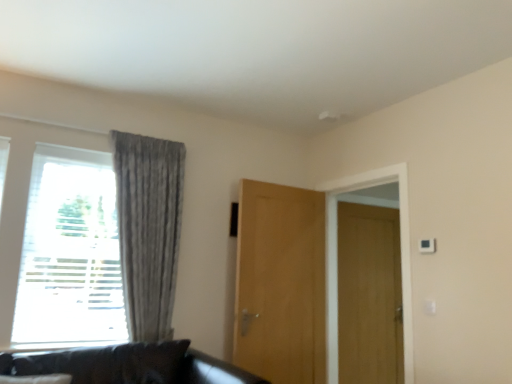
Image resolution: width=512 pixels, height=384 pixels. What do you see at coordinates (369, 295) in the screenshot? I see `wooden door at right, which ranks as the 2th door in left-to-right order` at bounding box center [369, 295].

The height and width of the screenshot is (384, 512). What do you see at coordinates (280, 283) in the screenshot? I see `light brown wood door at center, arranged as the 1th door when viewed from the front` at bounding box center [280, 283].

This screenshot has height=384, width=512. What do you see at coordinates (148, 229) in the screenshot?
I see `gray textured curtain at left` at bounding box center [148, 229].

What do you see at coordinates (26, 195) in the screenshot?
I see `white textured window at left` at bounding box center [26, 195].

This screenshot has width=512, height=384. Identify the location of wooden door at right, placed as the 1th door when sorted from back to front. (369, 295).

From the image's perspective, between light brown wood door at center, the second door when ordered from back to front, and white textured window at left, which one is located above?

white textured window at left, from the image's perspective.

Is light brown wood door at center, arranged as the 1th door when viewed from the front, in contact with white textured window at left?

No, light brown wood door at center, arranged as the 1th door when viewed from the front, is not making contact with white textured window at left.

I want to click on window located above the light brown wood door at center, the second door when ordered from back to front (from the image's perspective), so click(26, 195).

Is light brown wood door at center, the second door when ordered from back to front, facing away from white textured window at left?

That's not correct — light brown wood door at center, the second door when ordered from back to front, is not looking away from white textured window at left.

Could you tell me if wooden door at right, the second door viewed from the front, is turned towards gray textured curtain at left?

No, wooden door at right, the second door viewed from the front, is not turned towards gray textured curtain at left.

Is wooden door at right, the second door viewed from the front, situated inside gray textured curtain at left or outside?

wooden door at right, the second door viewed from the front, lies outside gray textured curtain at left.

Consider the image. Considering the relative sizes of wooden door at right, positioned as the first door in right-to-left order, and gray textured curtain at left in the image provided, is wooden door at right, positioned as the first door in right-to-left order, thinner than gray textured curtain at left?

Indeed, wooden door at right, positioned as the first door in right-to-left order, has a lesser width compared to gray textured curtain at left.

You are a GUI agent. You are given a task and a screenshot of the screen. Output one action in this format:
    pyautogui.click(x=<x>, y=<y>)
    Task: Click on the window below the gray textured curtain at left (from a real-world perspective)
    The image size is (512, 384).
    Given the screenshot: What is the action you would take?
    [x=26, y=195]

Can you confirm if gray textured curtain at left is positioned to the right of white textured window at left?

Correct, you'll find gray textured curtain at left to the right of white textured window at left.

Considering the sizes of objects gray textured curtain at left and white textured window at left in the image provided, who is wider, gray textured curtain at left or white textured window at left?

gray textured curtain at left.

Is gray textured curtain at left looking in the opposite direction of white textured window at left?

Yes, gray textured curtain at left's orientation is away from white textured window at left.

Measure the distance from gray textured curtain at left to light brown wood door at center, the second door in the right-to-left sequence.

gray textured curtain at left and light brown wood door at center, the second door in the right-to-left sequence, are 30.14 inches apart.

Which is behind, gray textured curtain at left or light brown wood door at center, arranged as the 1th door when viewed from the front?

light brown wood door at center, arranged as the 1th door when viewed from the front, is more distant.

Consider the image. From a real-world perspective, does gray textured curtain at left stand above light brown wood door at center, the second door when ordered from back to front?

Correct, in the physical world, gray textured curtain at left is higher than light brown wood door at center, the second door when ordered from back to front.

Consider the image. Is gray textured curtain at left bigger than light brown wood door at center, the 1th door viewed from the left?

Yes.

Are white textured window at left and gray textured curtain at left beside each other?

No, white textured window at left is not in contact with gray textured curtain at left.

From a real-world perspective, between white textured window at left and gray textured curtain at left, who is vertically higher?

gray textured curtain at left.

Is white textured window at left oriented towards gray textured curtain at left?

Yes.

Which object is wider, white textured window at left or gray textured curtain at left?

Wider between the two is gray textured curtain at left.

Does wooden door at right, the second door viewed from the front, have a smaller size compared to white textured window at left?

Indeed, wooden door at right, the second door viewed from the front, has a smaller size compared to white textured window at left.

Is wooden door at right, positioned as the first door in right-to-left order, positioned far away from white textured window at left?

Yes, wooden door at right, positioned as the first door in right-to-left order, and white textured window at left are located far from each other.

Is wooden door at right, the second door viewed from the front, to the right of white textured window at left from the viewer's perspective?

Correct, you'll find wooden door at right, the second door viewed from the front, to the right of white textured window at left.

Would you say wooden door at right, placed as the 1th door when sorted from back to front, is inside or outside white textured window at left?

wooden door at right, placed as the 1th door when sorted from back to front, is not enclosed by white textured window at left.

From a real-world perspective, which is physically above, white textured window at left or wooden door at right, placed as the 1th door when sorted from back to front?

white textured window at left is physically above.

Between white textured window at left and wooden door at right, positioned as the first door in right-to-left order, which one has smaller size?

wooden door at right, positioned as the first door in right-to-left order, is smaller.

At what (x,y) coordinates should I click in order to perform the action: click on the 2nd door located beneath the white textured window at left (from a real-world perspective). Please return your answer as a coordinate pair (x, y). The height and width of the screenshot is (384, 512). Looking at the image, I should click on (369, 295).

Is point (64, 137) behind point (396, 365)?

No, it is not.

Where is `door that is the 1st one when counting backward from the white textured window at left`? door that is the 1st one when counting backward from the white textured window at left is located at coordinates (280, 283).

The image size is (512, 384). I want to click on the 2nd door positioned below the gray textured curtain at left (from a real-world perspective), so click(369, 295).

Looking at the image, which one is located further to light brown wood door at center, the second door in the right-to-left sequence, white textured window at left or wooden door at right, which ranks as the 2th door in left-to-right order?

Based on the image, white textured window at left appears to be further to light brown wood door at center, the second door in the right-to-left sequence.

When comparing their distances from light brown wood door at center, the 1th door viewed from the left, does wooden door at right, placed as the 1th door when sorted from back to front, or gray textured curtain at left seem further?

gray textured curtain at left is positioned further to the anchor light brown wood door at center, the 1th door viewed from the left.

From the image, which object appears to be nearer to wooden door at right, positioned as the first door in right-to-left order, gray textured curtain at left or white textured window at left?

The object closer to wooden door at right, positioned as the first door in right-to-left order, is gray textured curtain at left.

Based on their spatial positions, is wooden door at right, placed as the 1th door when sorted from back to front, or light brown wood door at center, the 1th door viewed from the left, closer to gray textured curtain at left?

light brown wood door at center, the 1th door viewed from the left, is closer to gray textured curtain at left.

Looking at the image, which one is located further to white textured window at left, light brown wood door at center, arranged as the 1th door when viewed from the front, or wooden door at right, which ranks as the 2th door in left-to-right order?

The object further to white textured window at left is wooden door at right, which ranks as the 2th door in left-to-right order.

Looking at the image, which one is located further to white textured window at left, gray textured curtain at left or wooden door at right, the second door viewed from the front?

The object further to white textured window at left is wooden door at right, the second door viewed from the front.

Considering their positions, is white textured window at left positioned closer to light brown wood door at center, the 1th door viewed from the left, than gray textured curtain at left?

Among the two, gray textured curtain at left is located nearer to light brown wood door at center, the 1th door viewed from the left.

From the image, which object appears to be farther from white textured window at left, gray textured curtain at left or light brown wood door at center, the second door when ordered from back to front?

light brown wood door at center, the second door when ordered from back to front.

Locate an element on the screen. door between gray textured curtain at left and wooden door at right, the second door viewed from the front, from left to right is located at coordinates (280, 283).

Identify the location of curtain located between white textured window at left and light brown wood door at center, arranged as the 1th door when viewed from the front, in the left-right direction. This screenshot has width=512, height=384. (148, 229).

Where is `curtain located between white textured window at left and wooden door at right, which ranks as the 2th door in left-to-right order, in the left-right direction`? This screenshot has height=384, width=512. curtain located between white textured window at left and wooden door at right, which ranks as the 2th door in left-to-right order, in the left-right direction is located at coordinates (148, 229).

Identify the location of door located between white textured window at left and wooden door at right, positioned as the first door in right-to-left order, in the left-right direction. The image size is (512, 384). (280, 283).